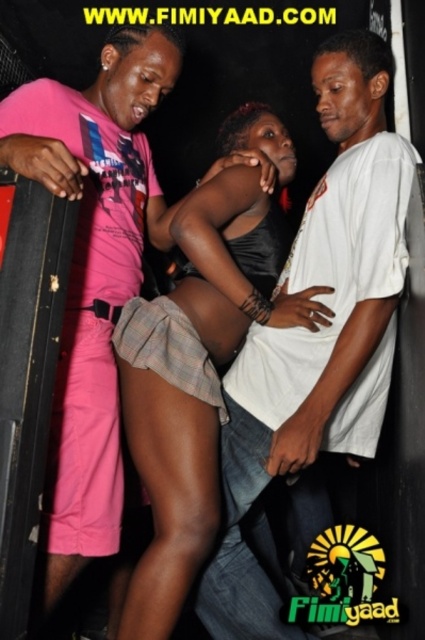
Is point (379, 401) positioned in front of point (116, 221)?

Yes, it is in front of point (116, 221).

Is white matte shirt at center above white cotton shirt at center?

No.

In order to click on white matte shirt at center in this screenshot , I will do `click(317, 330)`.

Find the location of a particular element. white matte shirt at center is located at coordinates (317, 330).

Can you confirm if white matte shirt at center is positioned to the right of black satin dress at center?

Indeed, white matte shirt at center is positioned on the right side of black satin dress at center.

From the picture: Does white matte shirt at center have a smaller size compared to black satin dress at center?

Indeed, white matte shirt at center has a smaller size compared to black satin dress at center.

Does point (266, 429) come in front of point (227, 323)?

Yes, point (266, 429) is in front of point (227, 323).

Find the location of a particular element. white matte shirt at center is located at coordinates (317, 330).

Who is lower down, white cotton shirt at center or black satin dress at center?

black satin dress at center is below.

Can you confirm if white cotton shirt at center is wider than black satin dress at center?

No, white cotton shirt at center is not wider than black satin dress at center.

Is point (142, 109) positioned before point (278, 129)?

That is True.

In order to click on white cotton shirt at center in this screenshot , I will do `click(95, 266)`.